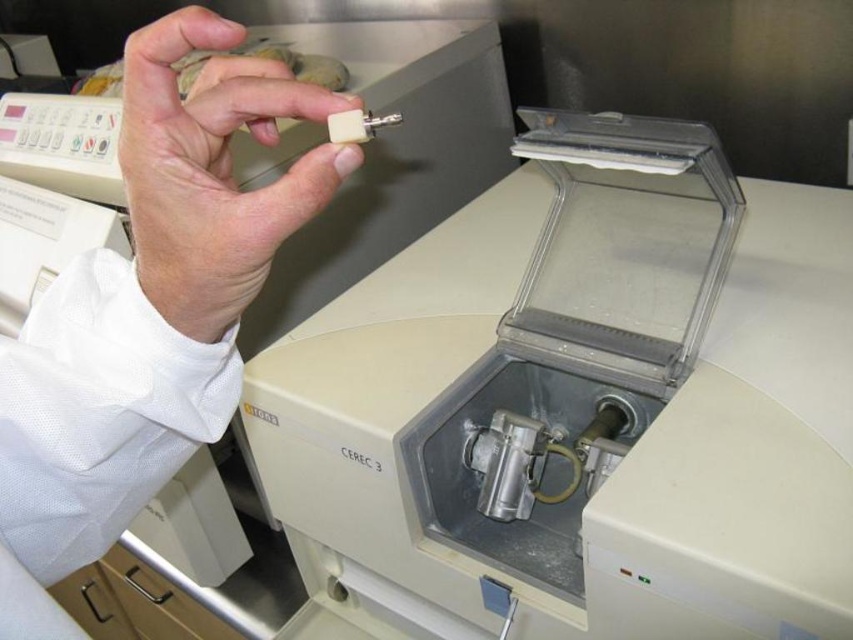
You are a dental technician working in the lab shown. You need to place the matte white tooth at upper left and the matte white tooth at upper center into a storage tray. Which tooth should you place first if you want to arrange them from left to right as they appear in the image?

You should place the matte white tooth at upper left first because it is positioned on the left side of the matte white tooth at upper center in the image.

You are a dental technician working in the lab and need to place a new ceramic block into the CEREC 3 machine. You see the matte white tooth at upper left and the matte white tooth at upper center. Which tooth is closer to you and should you handle first?

The matte white tooth at upper left is closer to you than the matte white tooth at upper center, so you should handle the matte white tooth at upper left first.